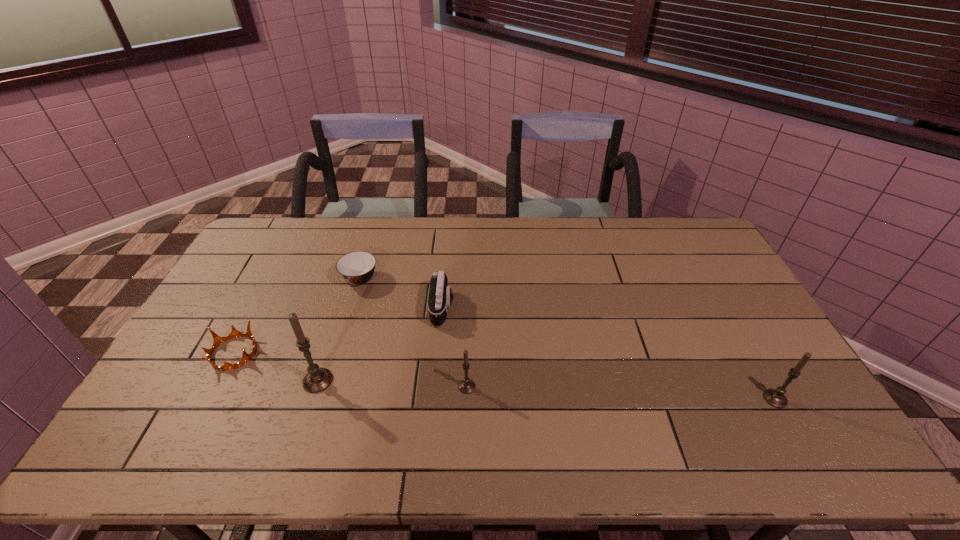
This screenshot has width=960, height=540. I want to click on vacant space at the near edge, so 348,401.

I want to click on free spot at the left edge of the desktop, so click(x=260, y=258).

Find the location of a particular element. The image size is (960, 540). vacant space at the right edge of the desktop is located at coordinates (751, 320).

The width and height of the screenshot is (960, 540). I want to click on blank area at the far left corner, so click(254, 250).

Image resolution: width=960 pixels, height=540 pixels. In order to click on empty space between the second candle from left to right and the rightmost object in this screenshot , I will do `click(621, 393)`.

Find the location of a particular element. free spot between the leftmost object and the third object from right to left is located at coordinates (338, 330).

At what (x,y) coordinates should I click in order to perform the action: click on vacant region between the rightmost object and the fourth object from left to right. Please return your answer as a coordinate pair (x, y). The image size is (960, 540). Looking at the image, I should click on (609, 353).

Where is `empty location between the leftmost candle and the third shortest object`? empty location between the leftmost candle and the third shortest object is located at coordinates (380, 345).

Where is `vacant area that lies between the crown and the second tallest object`? The height and width of the screenshot is (540, 960). vacant area that lies between the crown and the second tallest object is located at coordinates (504, 376).

Locate an element on the screen. Image resolution: width=960 pixels, height=540 pixels. free space between the leftmost object and the camera is located at coordinates (338, 330).